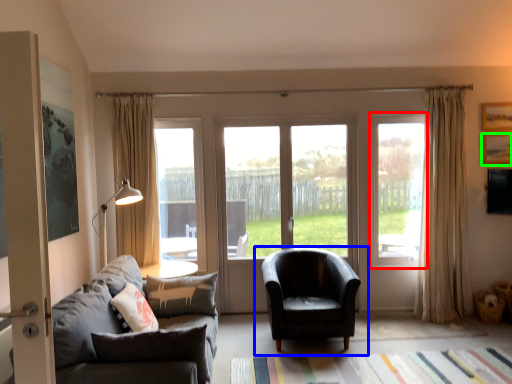
Question: Estimate the real-world distances between objects in this image. Which object is closer to window (highlighted by a red box), chair (highlighted by a blue box) or picture frame (highlighted by a green box)?

Choices:
 (A) chair
 (B) picture frame

Answer: (B)